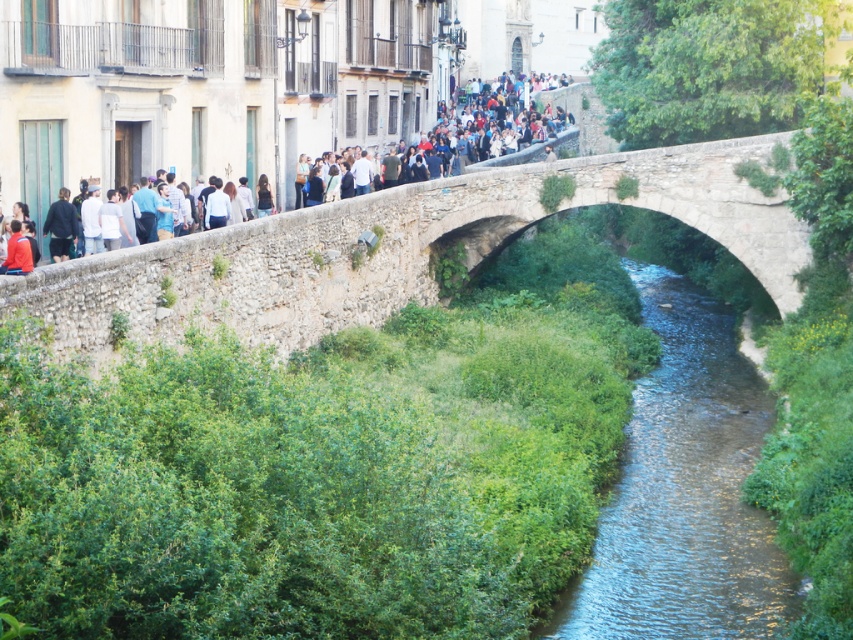
You are a tourist standing on the stone arch bridge at upper center and looking towards the clear water stream at center. Which object is closer to you?

The clear water stream at center is closer to you because it is in front of the stone arch bridge at upper center, meaning the bridge is behind it from your perspective.

You are standing at the entrance of the European style buildings on the left side of the stone arch bridge at upper center and matte stone bridge at upper center. You want to cross the river to the other side. Which bridge should you use to reach the other side first?

The stone arch bridge at upper center is located below the matte stone bridge at upper center, so you should use the stone arch bridge at upper center to reach the other side first since it is closer to the river.